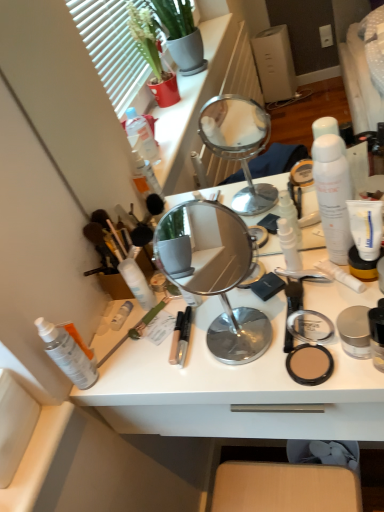
Locate an element on the screen. The width and height of the screenshot is (384, 512). vacant area that lies between transparent plastic spray bottle at lower left, the 6th toiletry viewed from the right, and white matte tube at right, acting as the first toothpaste starting from the top is located at coordinates click(202, 338).